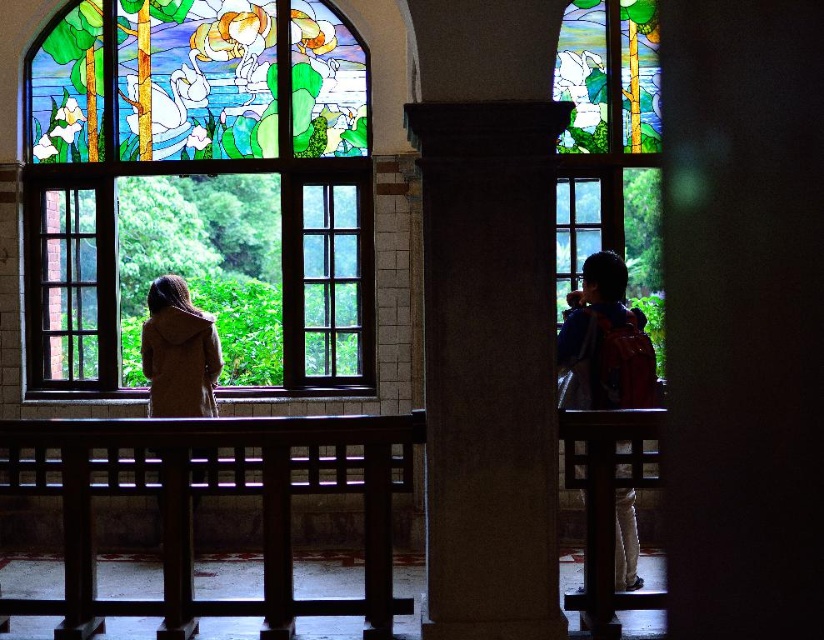
Does dark brown wooden bench at center have a greater height compared to blue denim jacket at right?

Indeed, dark brown wooden bench at center has a greater height compared to blue denim jacket at right.

The height and width of the screenshot is (640, 824). Describe the element at coordinates (212, 493) in the screenshot. I see `dark brown wooden bench at center` at that location.

Locate an element on the screen. This screenshot has width=824, height=640. dark brown wooden bench at center is located at coordinates (212, 493).

Find the location of a particular element. The image size is (824, 640). dark brown wooden bench at center is located at coordinates (212, 493).

Does stained glass window at upper left lie behind dark brown wooden bench at center?

Yes, it is behind dark brown wooden bench at center.

Does stained glass window at upper left come in front of dark brown wooden bench at center?

No, stained glass window at upper left is behind dark brown wooden bench at center.

Identify the location of stained glass window at upper left. pos(199,173).

Does smooth stone pillar at center appear on the left side of wooden bench at lower right?

Indeed, smooth stone pillar at center is positioned on the left side of wooden bench at lower right.

What do you see at coordinates (489, 365) in the screenshot? I see `smooth stone pillar at center` at bounding box center [489, 365].

This screenshot has height=640, width=824. I want to click on smooth stone pillar at center, so click(x=489, y=365).